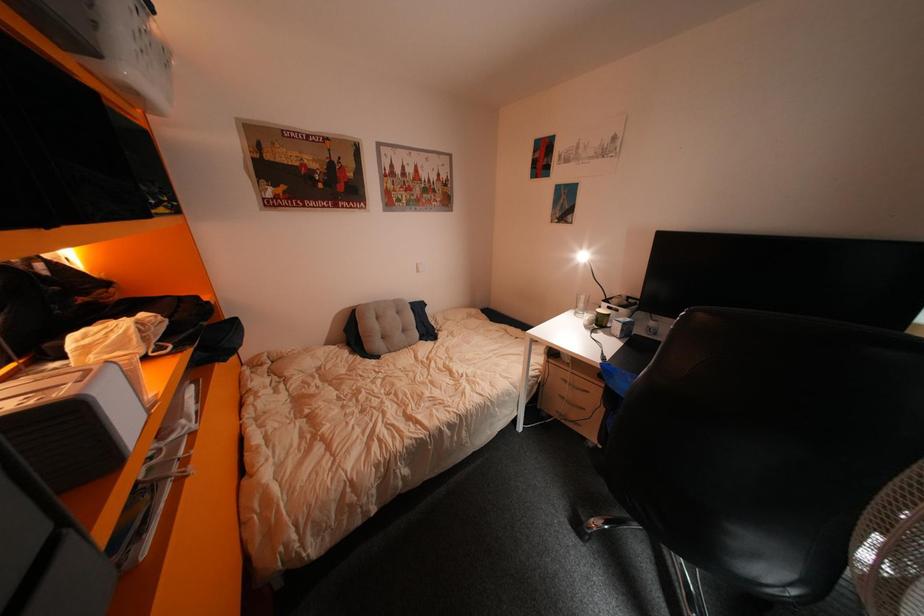
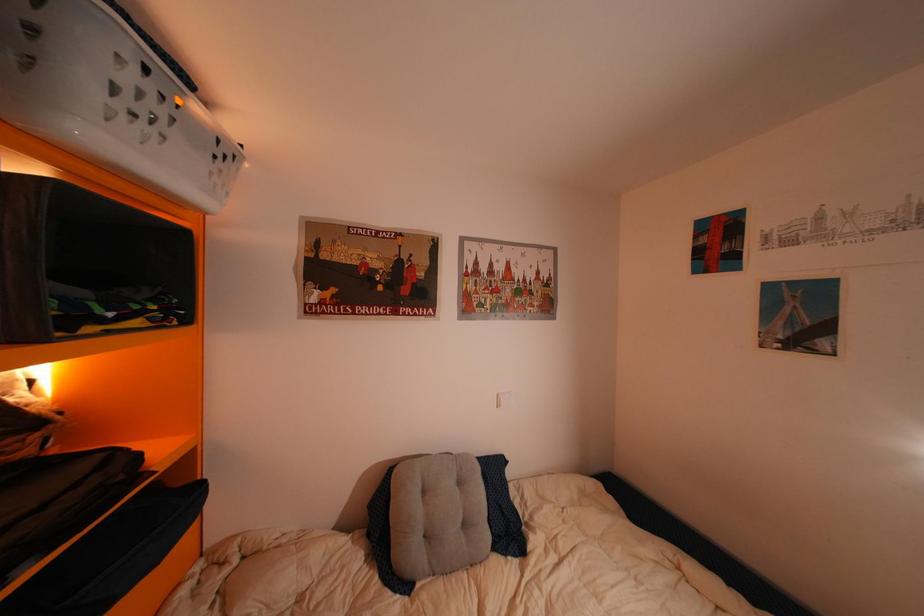
Question: In a continuous first-person perspective shot, in which direction is the camera moving?

Choices:
 (A) Left
 (B) Right
 (C) Forward
 (D) Backward

Answer: (C)